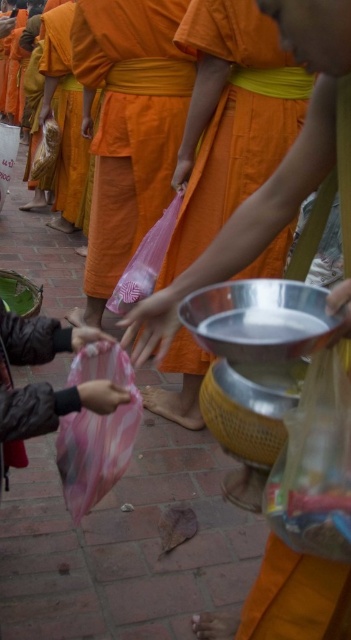
Does smooth plastic bag at center have a larger size compared to pink fabric bag at lower left?

Yes.

Does smooth plastic bag at center have a greater width compared to pink fabric bag at lower left?

No.

Find the location of a particular element. smooth plastic bag at center is located at coordinates (341, 307).

Image resolution: width=351 pixels, height=640 pixels. What are the coordinates of `smooth plastic bag at center` in the screenshot? It's located at (341, 307).

Is point (48, 52) positioned before point (142, 330)?

No.

How far apart are orange cloth at left and pink fabric hand at center?

3.31 meters

Which is in front, point (67, 49) or point (159, 296)?

Point (159, 296) is more forward.

Find the location of a particular element. orange cloth at left is located at coordinates (64, 116).

Which of these two, orange matte/soft robe at center or pink fabric hand at center, stands taller?

orange matte/soft robe at center

Which is below, orange matte/soft robe at center or pink fabric hand at center?

pink fabric hand at center is lower down.

You are a GUI agent. You are given a task and a screenshot of the screen. Output one action in this format:
    pyautogui.click(x=<x>, y=<y>)
    Task: Click on the orange matte/soft robe at center
    This screenshot has width=351, height=640.
    Given the screenshot: What is the action you would take?
    pyautogui.click(x=230, y=120)